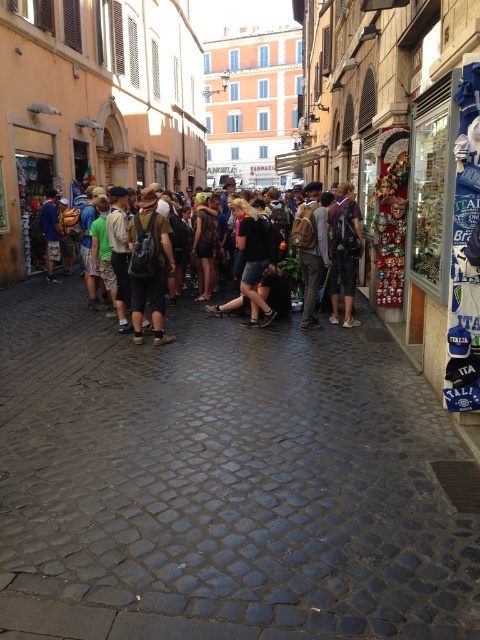
Question: Which of the following is the farthest from the observer?

Choices:
 (A) multicolored backpacks at center
 (B) dark gray cobblestone at center
 (C) matte black backpack at center

Answer: (A)

Question: Based on their relative distances, which object is farther from the multicolored backpacks at center?

Choices:
 (A) dark blue jeans at center
 (B) denim shorts at center
 (C) brown backpack at center

Answer: (A)

Question: Does dark blue jeans at center appear under brown backpack at center?

Choices:
 (A) yes
 (B) no

Answer: (B)

Question: Can you confirm if brown backpack at center is positioned to the left of denim shorts at center?

Choices:
 (A) yes
 (B) no

Answer: (B)

Question: Among these objects, which one is nearest to the camera?

Choices:
 (A) multicolored backpacks at center
 (B) brown backpack at center
 (C) matte black backpack at center
 (D) dark brown leather jacket at center

Answer: (C)

Question: Is dark gray cobblestone at center bigger than denim shorts at center?

Choices:
 (A) yes
 (B) no

Answer: (B)